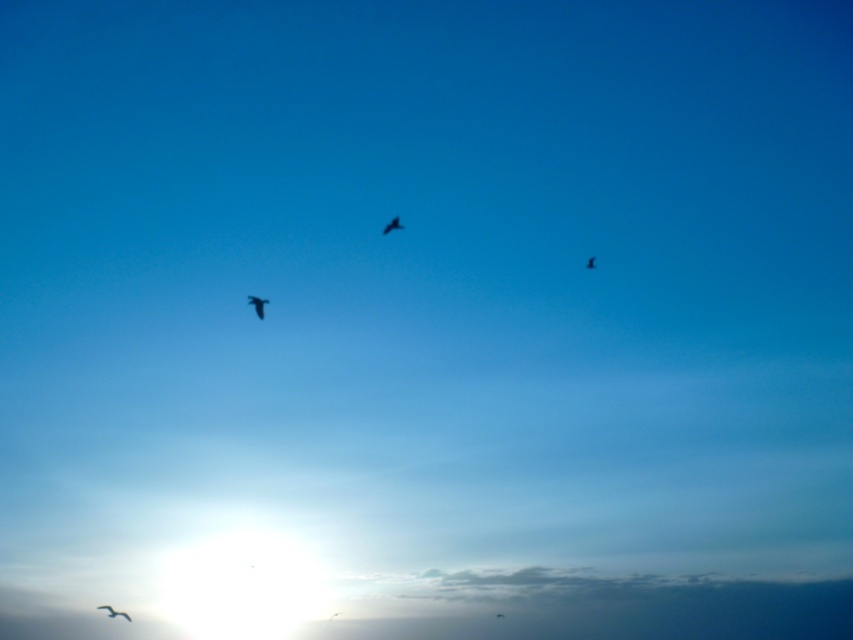
You are an astronomer analyzing the image. You need to determine the exact position of the silhouette feathered bird at center. What are its coordinates?

The silhouette feathered bird at center is located at coordinates (257, 305).

In the scene shown: You are an astronomer analyzing the image. You see the silhouette feathered bird at lower left. What are the coordinates of its position in the image?

The silhouette feathered bird at lower left is located at coordinates point (113,612).

You are an ornithologist observing birds in the sky. You notice two birds, the silhouette feathered bird at center and the black matte bird at upper center. Which bird do you think is farther away from you?

The silhouette feathered bird at center is smaller in size compared to the black matte bird at upper center, which typically indicates that it is farther away since objects appear smaller with distance.